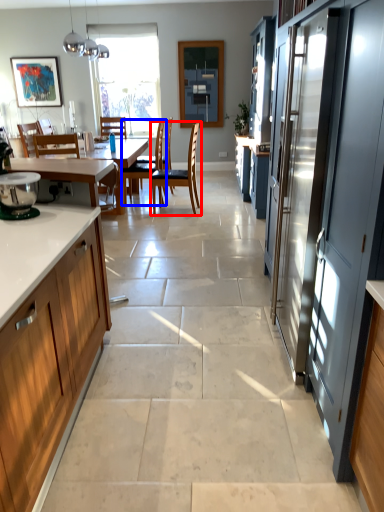
Question: Which object is closer to the camera taking this photo, chair (highlighted by a red box) or chair (highlighted by a blue box)?

Choices:
 (A) chair
 (B) chair

Answer: (A)